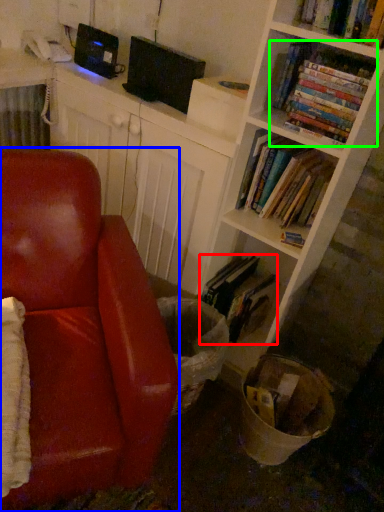
Question: Which object is the closest to the book (highlighted by a red box)? Choose among these: chair (highlighted by a blue box) or book (highlighted by a green box).

Choices:
 (A) chair
 (B) book

Answer: (A)